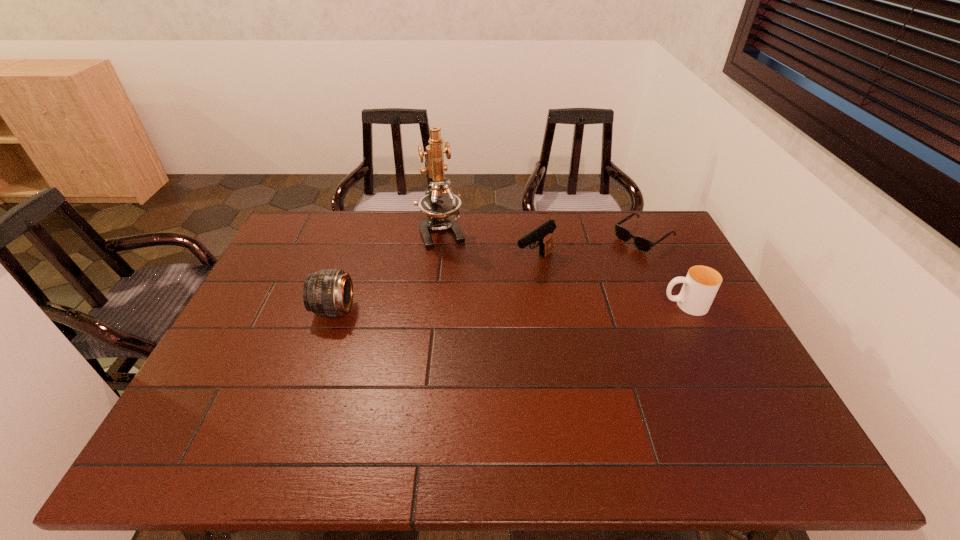
Image resolution: width=960 pixels, height=540 pixels. In order to click on free space on the desktop that is between the telephoto lens and the second shortest object and is positioned at the front lenses of the shortest object in this screenshot , I will do `click(540, 307)`.

Where is `free space on the desktop that is between the telephoto lens and the second shortest object and is positioned at the barrel of the third object from right to left`? free space on the desktop that is between the telephoto lens and the second shortest object and is positioned at the barrel of the third object from right to left is located at coordinates (470, 308).

Locate an element on the screen. The image size is (960, 540). vacant spot on the desktop that is between the telephoto lens and the cup and is positioned at the eyepiece of the second object from left to right is located at coordinates (475, 308).